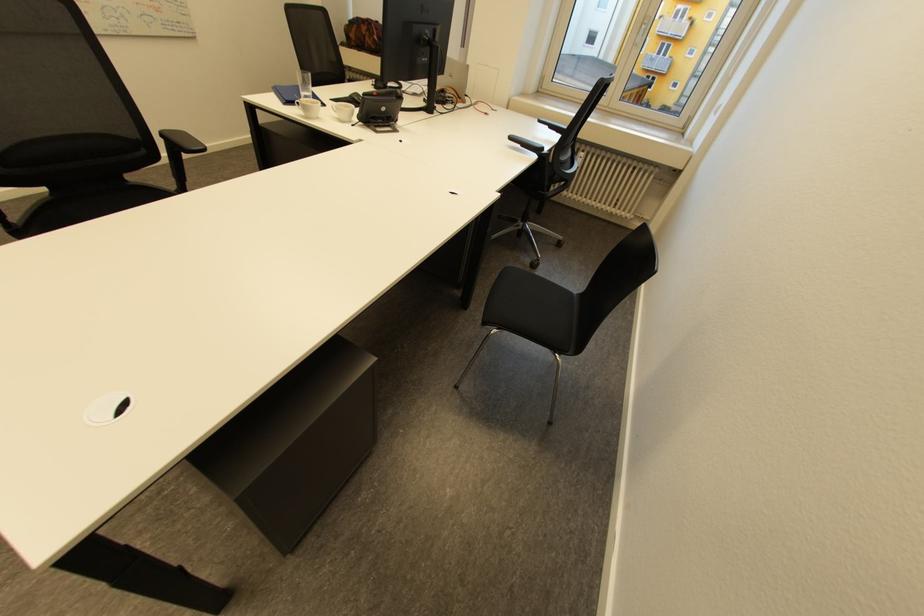
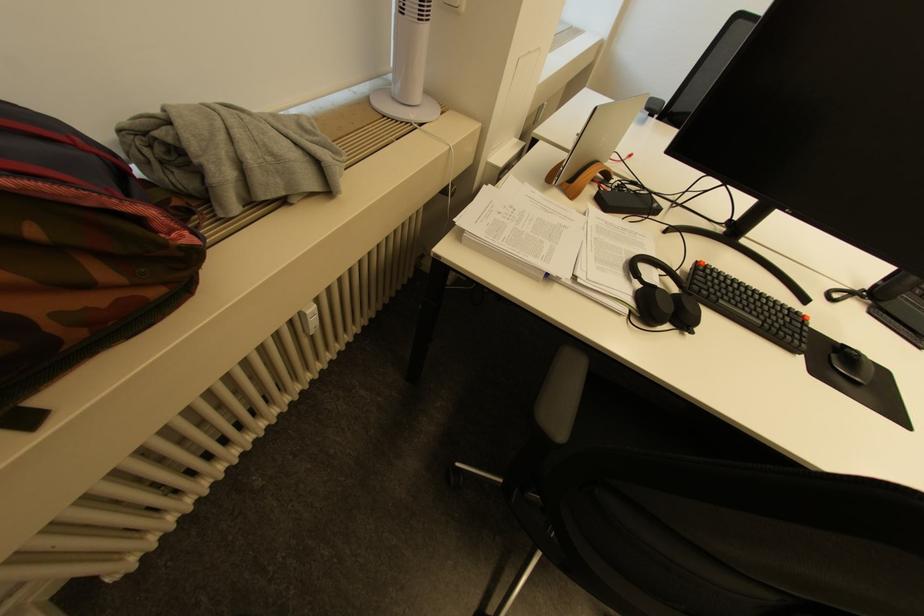
Where in the second image is the point corresponding to pixel 382 37 from the first image?

(196, 238)